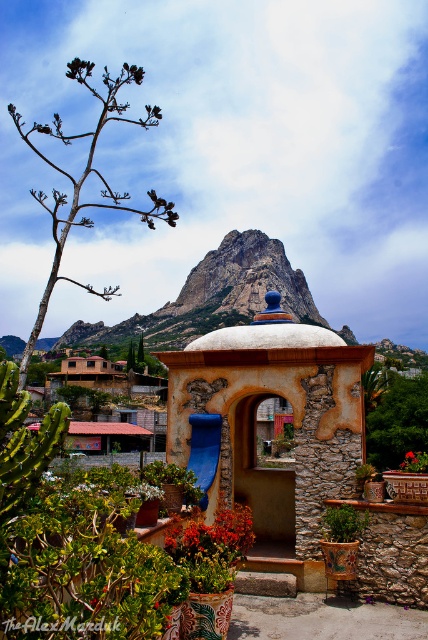
In the scene shown: Is rustic stone mountain at upper center thinner than brown woody tree at left?

In fact, rustic stone mountain at upper center might be wider than brown woody tree at left.

Where is `rustic stone mountain at upper center`? This screenshot has height=640, width=428. rustic stone mountain at upper center is located at coordinates (213, 296).

This screenshot has height=640, width=428. In order to click on rustic stone mountain at upper center in this screenshot , I will do `click(213, 296)`.

Can you confirm if brown woody tree at left is bigger than green leafy tree at center?

Yes.

Between brown woody tree at left and green leafy tree at center, which one has more height?

brown woody tree at left

Does point (97, 131) come farther from viewer compared to point (427, 400)?

Yes, it is behind point (427, 400).

Where is `brown woody tree at left`? The height and width of the screenshot is (640, 428). brown woody tree at left is located at coordinates (85, 180).

Does rustic stone mountain at upper center have a lesser height compared to green leafy tree at center?

No, rustic stone mountain at upper center is not shorter than green leafy tree at center.

Describe the element at coordinates (213, 296) in the screenshot. The width and height of the screenshot is (428, 640). I see `rustic stone mountain at upper center` at that location.

Describe the element at coordinates (213, 296) in the screenshot. I see `rustic stone mountain at upper center` at that location.

At what (x,y) coordinates should I click in order to perform the action: click on rustic stone mountain at upper center. Please return your answer as a coordinate pair (x, y). This screenshot has height=640, width=428. Looking at the image, I should click on (213, 296).